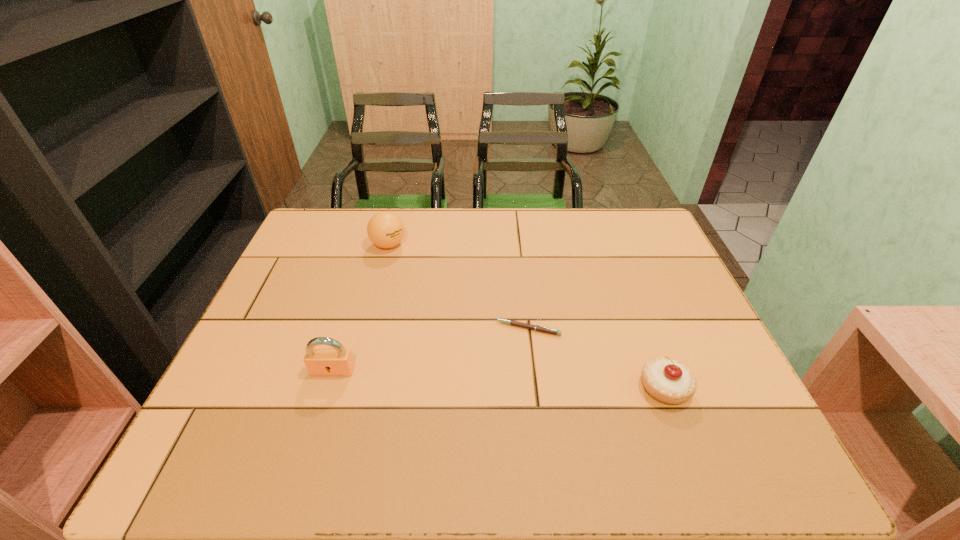
You are a GUI agent. You are given a task and a screenshot of the screen. Output one action in this format:
    pyautogui.click(x=<x>, y=<y>)
    Task: Click on the padlock
    The height and width of the screenshot is (540, 960).
    Given the screenshot: What is the action you would take?
    pyautogui.click(x=319, y=362)

Where is `the second shortest object`? the second shortest object is located at coordinates (669, 381).

Find the location of a particular element. Image resolution: width=960 pixels, height=540 pixels. pastry is located at coordinates (669, 381).

Image resolution: width=960 pixels, height=540 pixels. I want to click on pen, so click(x=538, y=328).

The image size is (960, 540). I want to click on the shortest object, so click(x=538, y=328).

I want to click on the farthest object, so click(x=385, y=229).

This screenshot has height=540, width=960. I want to click on free space located 0.090m to unlock the padlock from the front, so pyautogui.click(x=320, y=412).

Find the location of a particular element. This screenshot has height=540, width=960. blank space located 0.210m on the back of the pastry is located at coordinates [634, 304].

Locate an element on the screen. The width and height of the screenshot is (960, 540). blank space located 0.230m at the nib of the pen is located at coordinates (427, 384).

Where is `vacant area located at the nib of the pen`? Image resolution: width=960 pixels, height=540 pixels. vacant area located at the nib of the pen is located at coordinates (385, 413).